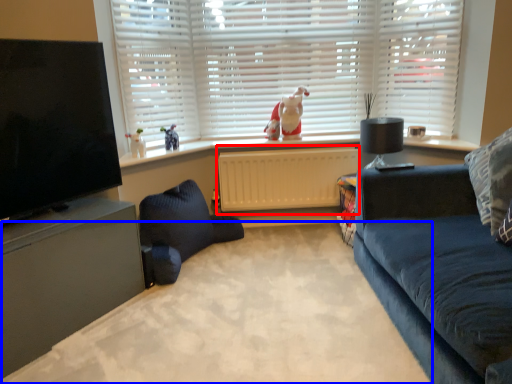
Question: Which object appears closest to the camera in this image, radiator (highlighted by a red box) or plain (highlighted by a blue box)?

Choices:
 (A) radiator
 (B) plain

Answer: (B)